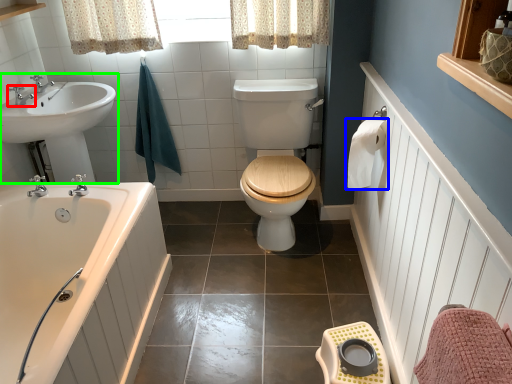
Question: Which object is positioned farthest from tap (highlighted by a red box)? Select from toilet paper (highlighted by a blue box) and sink (highlighted by a green box).

Choices:
 (A) toilet paper
 (B) sink

Answer: (A)